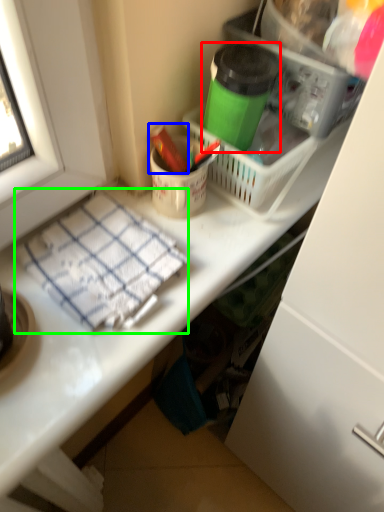
Question: Considering the real-world distances, which object is farthest from bottle (highlighted by a red box)? crayon (highlighted by a blue box) or blanket (highlighted by a green box)?

Choices:
 (A) crayon
 (B) blanket

Answer: (B)